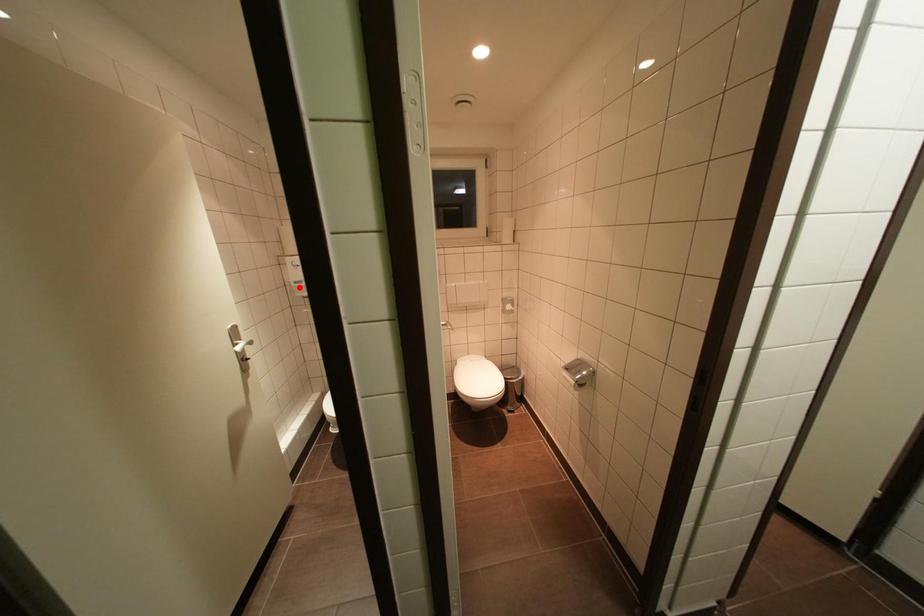
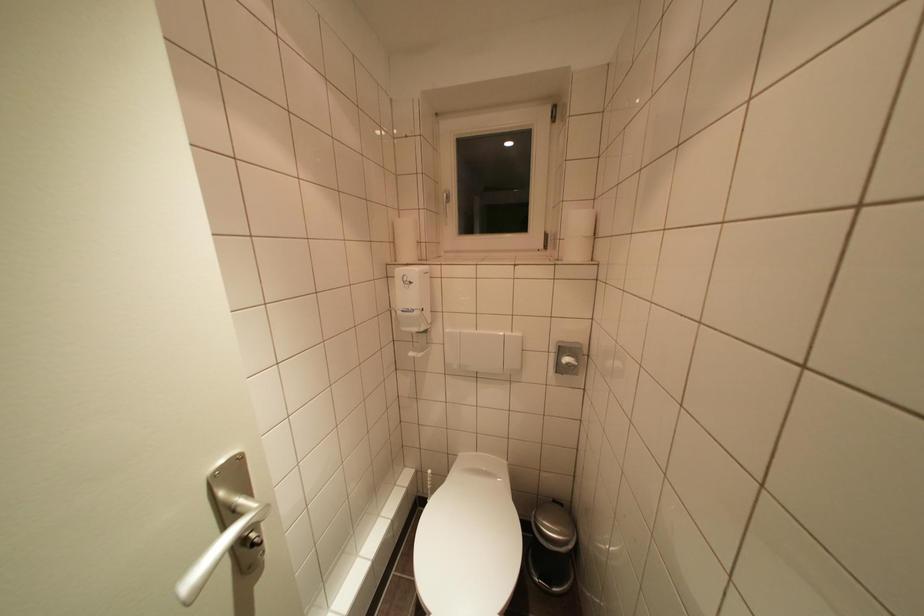
Locate, in the second image, the point that corresponds to the highlighted location in the first image.

(406, 315)